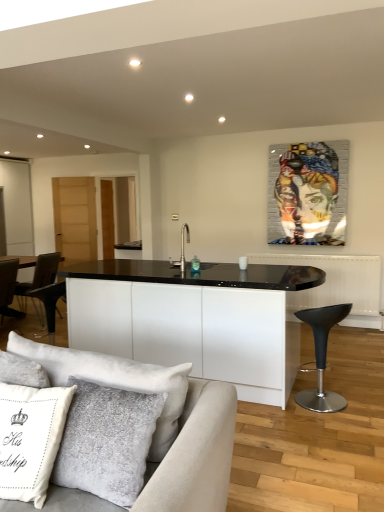
This screenshot has height=512, width=384. What are the coordinates of `black matte sink at center` in the screenshot? It's located at coord(182,251).

What is the approximate width of black matte sink at center?

black matte sink at center is 12.42 inches in width.

Describe the element at coordinates (322, 356) in the screenshot. I see `black leather stool at lower right` at that location.

This screenshot has height=512, width=384. In order to click on transparent glass door at left in this screenshot , I will do `click(17, 206)`.

The height and width of the screenshot is (512, 384). I want to click on white textured pillow at lower left, so click(30, 439).

Can you confirm if transparent glass door at left is smaller than metallic mosaic portrait at upper center?

No, transparent glass door at left is not smaller than metallic mosaic portrait at upper center.

Is transparent glass door at left wider or thinner than metallic mosaic portrait at upper center?

In the image, transparent glass door at left appears to be wider than metallic mosaic portrait at upper center.

Could you tell me if transparent glass door at left is facing metallic mosaic portrait at upper center?

Yes, transparent glass door at left is facing metallic mosaic portrait at upper center.

This screenshot has height=512, width=384. In order to click on glass door behind the metallic mosaic portrait at upper center in this screenshot , I will do `click(17, 206)`.

Which point is more forward, (183, 253) or (319, 362)?

The point (319, 362) is closer.

From the image's perspective, does black matte sink at center appear lower than black leather stool at lower right?

Incorrect, from the image's perspective, black matte sink at center is higher than black leather stool at lower right.

Which of these two, black matte sink at center or black leather stool at lower right, is wider?

With larger width is black leather stool at lower right.

Can you confirm if metallic mosaic portrait at upper center is bigger than black leather stool at lower right?

No, metallic mosaic portrait at upper center is not bigger than black leather stool at lower right.

Is metallic mosaic portrait at upper center in front of black leather stool at lower right?

No, it is not.

Does point (28, 170) appear closer or farther from the camera than point (209, 393)?

Point (28, 170) is positioned farther from the camera compared to point (209, 393).

Between transparent glass door at left and beige fabric couch at lower left, which one has less height?

beige fabric couch at lower left.

Considering the sizes of objects transparent glass door at left and beige fabric couch at lower left in the image provided, who is thinner, transparent glass door at left or beige fabric couch at lower left?

Thinner between the two is transparent glass door at left.

Where is `studio couch below the transparent glass door at left (from a real-world perspective)`? studio couch below the transparent glass door at left (from a real-world perspective) is located at coordinates (162, 423).

In the scene shown: Considering the sizes of metallic mosaic portrait at upper center and beige fabric couch at lower left in the image, is metallic mosaic portrait at upper center wider or thinner than beige fabric couch at lower left?

metallic mosaic portrait at upper center is thinner than beige fabric couch at lower left.

Is metallic mosaic portrait at upper center looking in the opposite direction of beige fabric couch at lower left?

metallic mosaic portrait at upper center is not turned away from beige fabric couch at lower left.

From the image's perspective, between metallic mosaic portrait at upper center and beige fabric couch at lower left, who is located below?

From the image's view, beige fabric couch at lower left is below.

From their relative heights in the image, would you say beige fabric couch at lower left is taller or shorter than black leather stool at lower right?

beige fabric couch at lower left is taller than black leather stool at lower right.

Between beige fabric couch at lower left and black leather stool at lower right, which one has larger width?

beige fabric couch at lower left.

From the image's perspective, between beige fabric couch at lower left and black leather stool at lower right, which one is located above?

From the image's view, black leather stool at lower right is above.

Is beige fabric couch at lower left far away from black leather stool at lower right?

beige fabric couch at lower left is far away from black leather stool at lower right.

Are transparent glass door at left and white textured pillow at lower left making contact?

No, transparent glass door at left is not touching white textured pillow at lower left.

Is transparent glass door at left wider than white textured pillow at lower left?

Indeed, transparent glass door at left has a greater width compared to white textured pillow at lower left.

In terms of size, does transparent glass door at left appear bigger or smaller than white textured pillow at lower left?

transparent glass door at left is bigger than white textured pillow at lower left.

Based on the photo, how many degrees apart are the facing directions of transparent glass door at left and white textured pillow at lower left?

97.1 degrees.

What are the coordinates of `glass door lying behind the metallic mosaic portrait at upper center` in the screenshot? It's located at (17, 206).

The height and width of the screenshot is (512, 384). I want to click on bar stool in front of the black matte sink at center, so click(x=322, y=356).

When comparing their distances from transparent glass door at left, does black matte sink at center or metallic mosaic portrait at upper center seem further?

Based on the image, metallic mosaic portrait at upper center appears to be further to transparent glass door at left.

When comparing their distances from black leather stool at lower right, does transparent glass door at left or metallic mosaic portrait at upper center seem closer?

Based on the image, metallic mosaic portrait at upper center appears to be nearer to black leather stool at lower right.

Looking at the image, which one is located closer to metallic mosaic portrait at upper center, black matte sink at center or black leather stool at lower right?

The object closer to metallic mosaic portrait at upper center is black matte sink at center.

Based on the photo, from the image, which object appears to be farther from transparent glass door at left, black leather stool at lower right or metallic mosaic portrait at upper center?

black leather stool at lower right lies further to transparent glass door at left than the other object.

Looking at the image, which one is located further to transparent glass door at left, metallic mosaic portrait at upper center or beige fabric couch at lower left?

beige fabric couch at lower left lies further to transparent glass door at left than the other object.

Looking at the image, which one is located closer to transparent glass door at left, white textured pillow at lower left or black matte sink at center?

Among the two, black matte sink at center is located nearer to transparent glass door at left.

When comparing their distances from beige fabric couch at lower left, does transparent glass door at left or black matte sink at center seem further?

→ transparent glass door at left lies further to beige fabric couch at lower left than the other object.

When comparing their distances from black leather stool at lower right, does white textured pillow at lower left or black matte sink at center seem further?

white textured pillow at lower left.

What are the coordinates of `bar stool positioned between beige fabric couch at lower left and black matte sink at center from near to far` in the screenshot? It's located at (322, 356).

Identify the location of bar stool between beige fabric couch at lower left and metallic mosaic portrait at upper center in the front-back direction. The image size is (384, 512). (322, 356).

The width and height of the screenshot is (384, 512). Find the location of `pillow between beige fabric couch at lower left and black matte sink at center from front to back`. pillow between beige fabric couch at lower left and black matte sink at center from front to back is located at coordinates (30, 439).

You are a GUI agent. You are given a task and a screenshot of the screen. Output one action in this format:
    pyautogui.click(x=<x>, y=<y>)
    Task: Click on the picture frame located between beige fabric couch at lower left and transparent glass door at left in the depth direction
    Image resolution: width=384 pixels, height=512 pixels.
    Given the screenshot: What is the action you would take?
    pyautogui.click(x=307, y=193)